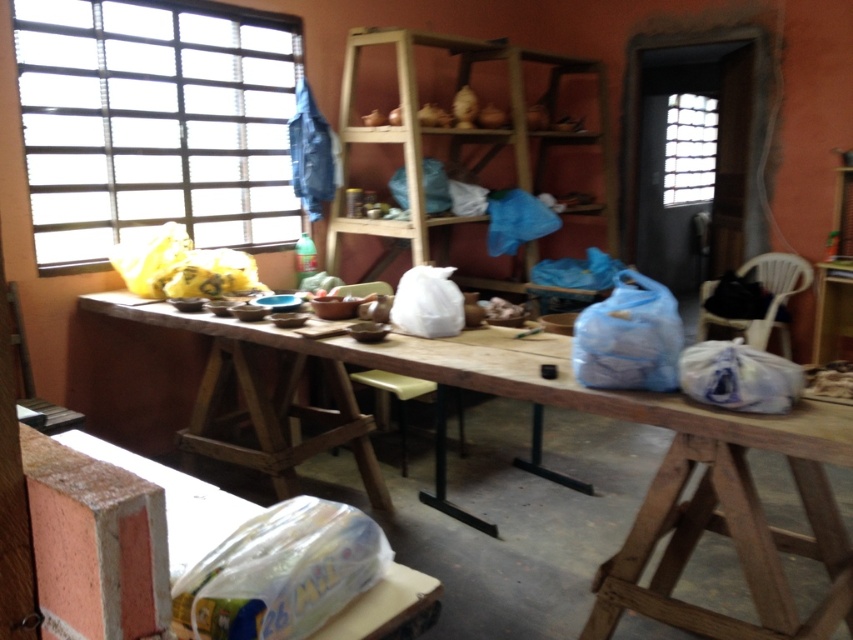
Question: Does white plastic bag at lower right have a smaller size compared to translucent glass window at upper right?

Choices:
 (A) yes
 (B) no

Answer: (A)

Question: In this image, where is wooden shelves at center located relative to translucent glass window at upper right?

Choices:
 (A) above
 (B) below

Answer: (B)

Question: Which point appears closest to the camera in this image?

Choices:
 (A) (695, 116)
 (B) (643, 346)
 (C) (424, 42)
 (D) (798, 388)

Answer: (D)

Question: Estimate the real-world distances between objects in this image. Which object is farther from the wooden shelves at center?

Choices:
 (A) blue plastic bag at right
 (B) transparent plastic window at upper left
 (C) white plastic bag at lower right
 (D) translucent glass window at upper right

Answer: (D)

Question: Can you confirm if transparent plastic window at upper left is smaller than white plastic bag at lower right?

Choices:
 (A) no
 (B) yes

Answer: (A)

Question: Which point is closer to the camera?

Choices:
 (A) (669, 122)
 (B) (790, 400)
 (C) (599, 384)
 (D) (419, 209)

Answer: (B)